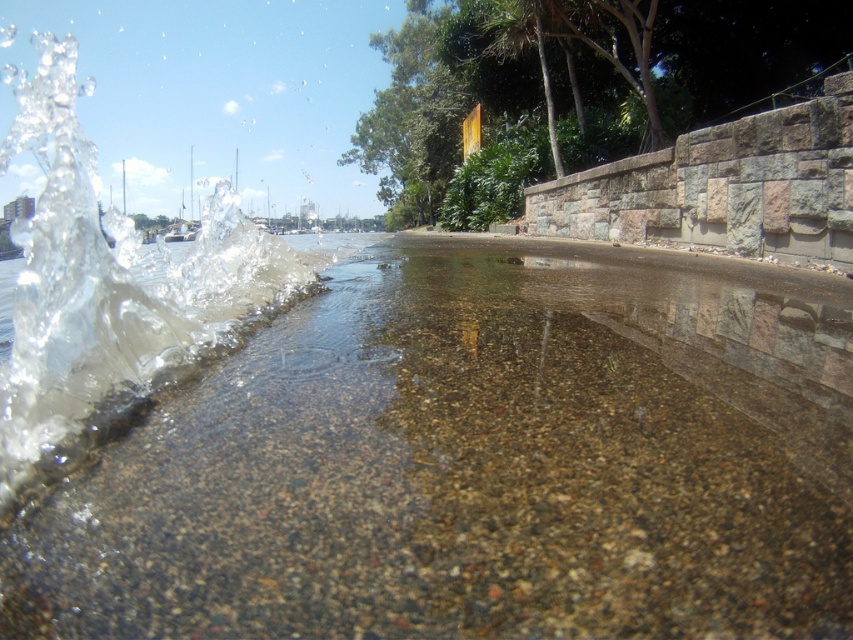
You are a photographer trying to capture the water splashing scene. You notice two areas of clear water at left and clear liquid water at left. Which area has a lower water level?

The clear water at left has a lesser height compared to clear liquid water at left, so the clear water at left has a lower water level.

You are a photographer analyzing the composition of the waterfront scene. You notice two instances labeled as clear water at left and clear liquid water at left. Which of these two occupies a smaller area in the image?

The clear water at left occupies less space than clear liquid water at left, so the clear water at left is the smaller one.

You are standing at the waterfront and see both the clear water at left and the clear liquid water at left. Which one is nearer to you?

The clear water at left is closer to the viewer than the clear liquid water at left.